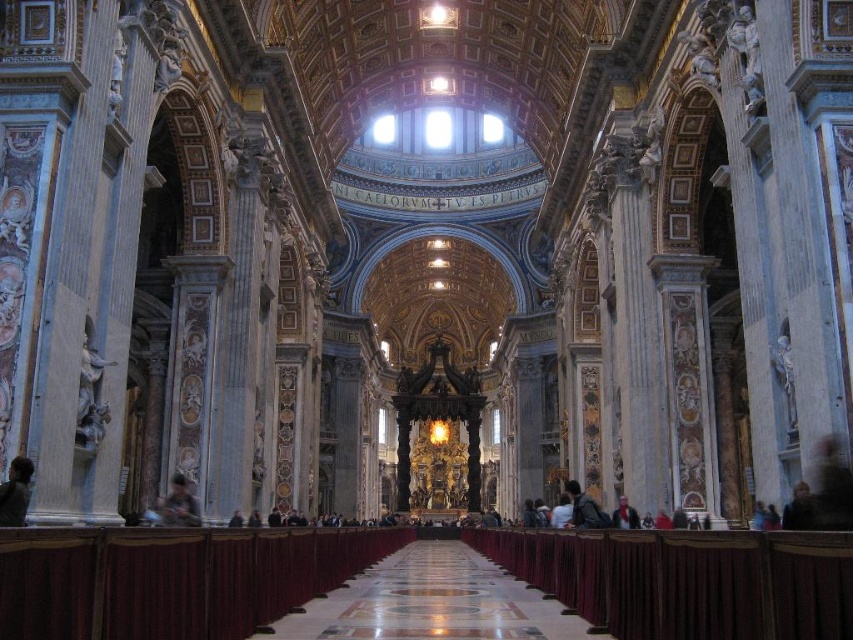
You are a visitor in the cathedral and want to place your belongings on the floor near the brown leather jacket at lower left and the dark gray fabric coat at lower center. Which item takes up more space on the floor?

The dark gray fabric coat at lower center takes up more space on the floor because it is larger than the brown leather jacket at lower left.

You are standing in the grand cathedral and want to move from one point to another. You are currently at point (793, 484) and want to reach point (622, 513). Which direction should you move to get closer to your destination?

To move from point (793, 484) to point (622, 513), you should move towards the direction of the altar area since point (622, 513) is further away from the viewer compared to point (793, 484), which is closer. Moving towards the altar area would take you in the correct direction.